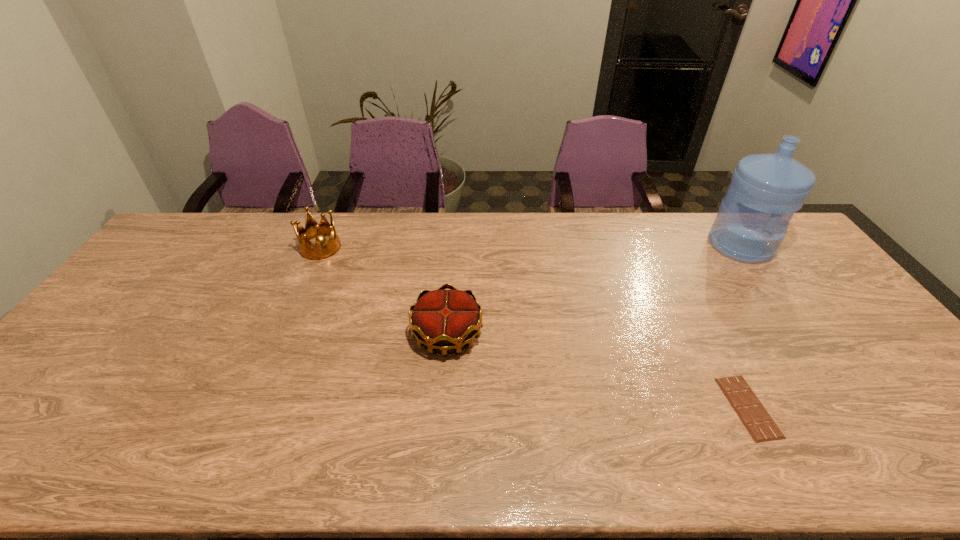
Find the location of a particular element. This screenshot has height=540, width=960. vacant space that's between the leftmost object and the shortest object is located at coordinates (535, 327).

Image resolution: width=960 pixels, height=540 pixels. Find the location of `empty space between the second nearest object and the water jug`. empty space between the second nearest object and the water jug is located at coordinates (594, 289).

Where is `object that ranks as the third closest to the rightmost object`? object that ranks as the third closest to the rightmost object is located at coordinates [323, 249].

Select which object appears as the closest to the third tallest object. Please provide its 2D coordinates. Your answer should be formatted as a tuple, i.e. [(x, y)], where the tuple contains the x and y coordinates of a point satisfying the conditions above.

[(323, 249)]

Where is `free space that satisfies the following two spatial constraints: 1. on the front side of the farther crown; 2. on the right side of the shorter crown`? The image size is (960, 540). free space that satisfies the following two spatial constraints: 1. on the front side of the farther crown; 2. on the right side of the shorter crown is located at coordinates (283, 334).